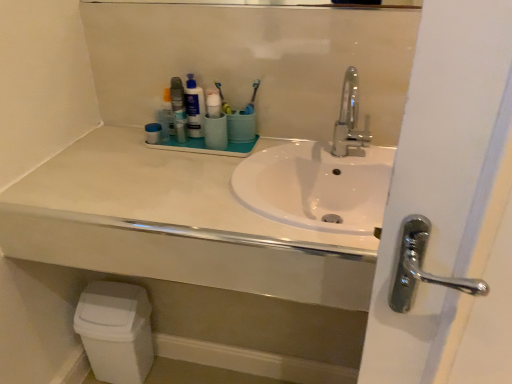
Where is `free space that is to the left of matte blue cup at center, the third toiletry when ordered from left to right`? This screenshot has height=384, width=512. free space that is to the left of matte blue cup at center, the third toiletry when ordered from left to right is located at coordinates (154, 151).